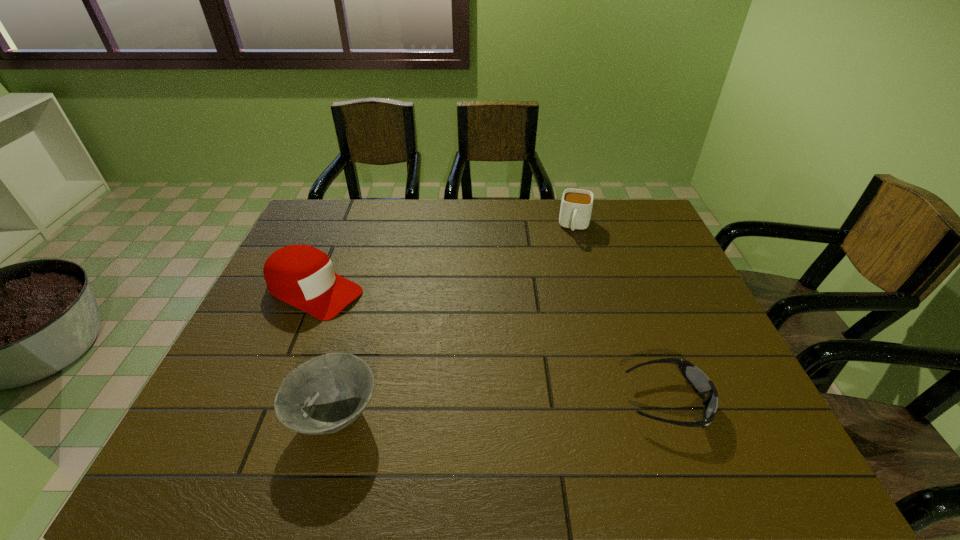
The height and width of the screenshot is (540, 960). Find the location of `free region at the right edge of the desktop`. free region at the right edge of the desktop is located at coordinates (660, 315).

You are a GUI agent. You are given a task and a screenshot of the screen. Output one action in this format:
    pyautogui.click(x=<x>, y=<y>)
    Task: Click on the free space between the sunglasses and the bowl
    This screenshot has width=960, height=540.
    Given the screenshot: What is the action you would take?
    pyautogui.click(x=501, y=409)

Find the location of a particular element. The height and width of the screenshot is (540, 960). free space between the shortest object and the farthest object is located at coordinates (621, 314).

This screenshot has height=540, width=960. Find the location of `free space between the sunglasses and the second farthest object`. free space between the sunglasses and the second farthest object is located at coordinates (491, 346).

The image size is (960, 540). I want to click on free area in between the baseball cap and the cup, so click(x=444, y=259).

This screenshot has width=960, height=540. What are the coordinates of `empty space that is in between the second farthest object and the sunglasses` in the screenshot? It's located at (491, 346).

The height and width of the screenshot is (540, 960). What are the coordinates of `empty space between the second farthest object and the bowl` in the screenshot? It's located at (324, 354).

Find the location of a particular element. free area in between the bowl and the farthest object is located at coordinates (455, 321).

Locate an element on the screen. Image resolution: width=960 pixels, height=540 pixels. free space between the bowl and the farthest object is located at coordinates (455, 321).

Where is `vacant space that is in between the second farthest object and the shortest object`? vacant space that is in between the second farthest object and the shortest object is located at coordinates (491, 346).